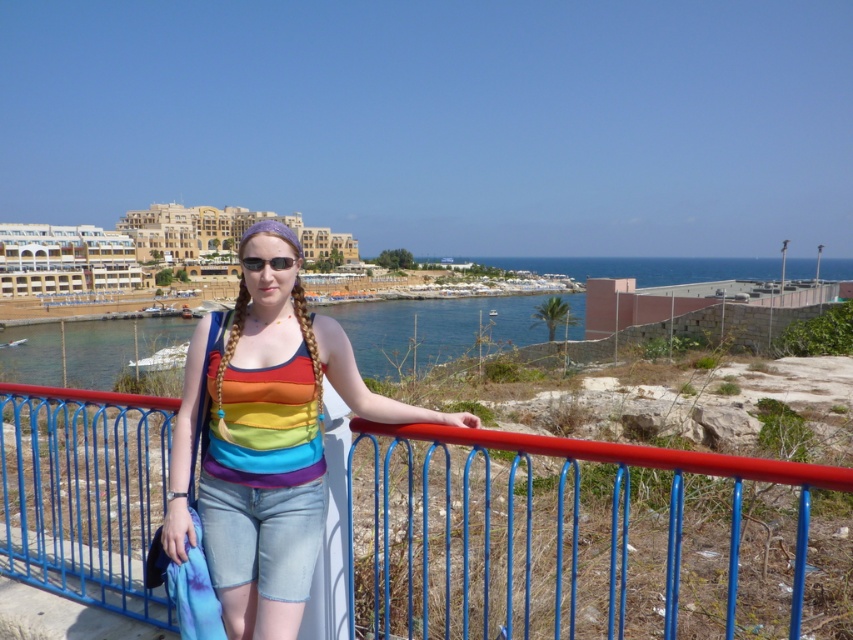
You are a photographer trying to capture the rainbow fabric tank top at center. You are currently standing at point (265, 440). Can you see the rainbow fabric tank top at center from your current position?

Answer: Yes, because the rainbow fabric tank top at center is exactly at your current position of point (265, 440), so you are directly at the location of the rainbow fabric tank top at center and can see it.

You are a photographer trying to capture the rainbow fabric tank top at center and the blue metal fence at center in a single frame. Based on the scene, which object is wider?

The blue metal fence at center is wider than the rainbow fabric tank top at center.

You are navigating a drone that needs to fly from point A to point B in the coastal resort scene. The coordinates for point A are point (219, 570) and point B are point (254, 266). According to the scene description, which point is closer to the observer?

Point (219, 570) is in front of point (254, 266), so point (219, 570) is closer to the observer.